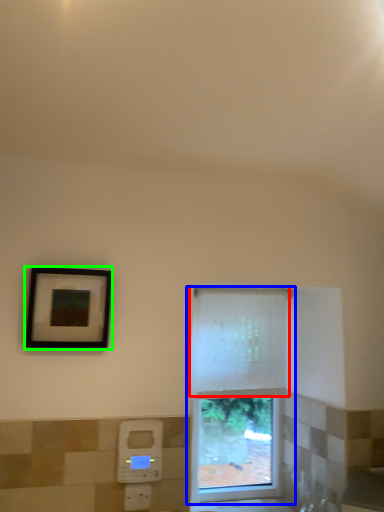
Question: Considering the real-world distances, which object is closest to curtain (highlighted by a red box)? window (highlighted by a blue box) or picture frame (highlighted by a green box).

Choices:
 (A) window
 (B) picture frame

Answer: (A)